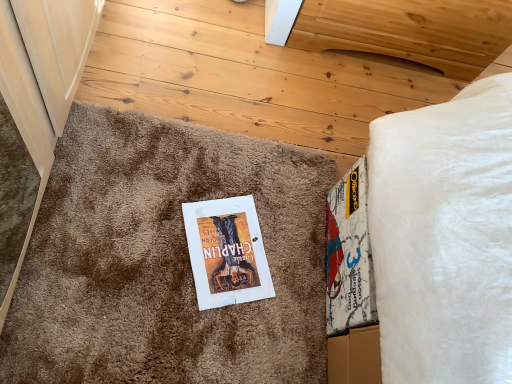
What are the coordinates of `vacant space that is to the left of white paper book at center` in the screenshot? It's located at (147, 209).